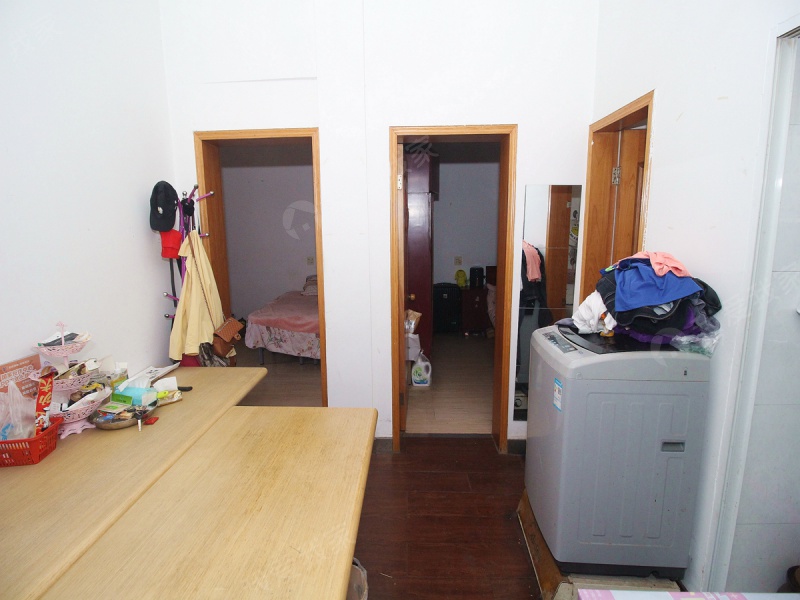
The width and height of the screenshot is (800, 600). I want to click on corners of the wall, so click(x=165, y=92), click(x=596, y=89).